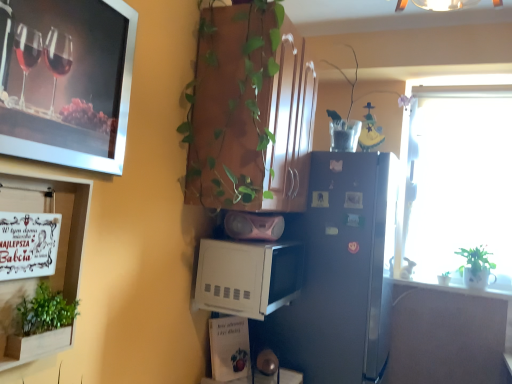
Where is `empty space that is ontop of white glossy counter top at right (from a real-world perspective)`? empty space that is ontop of white glossy counter top at right (from a real-world perspective) is located at coordinates (445, 284).